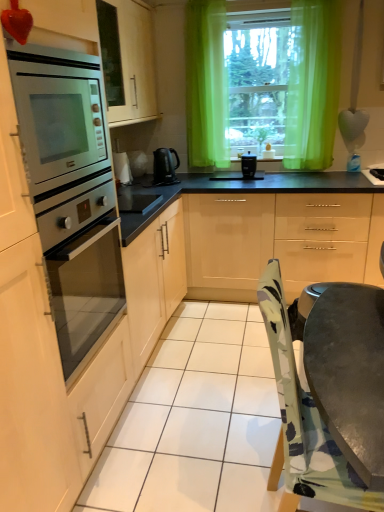
Question: From the image's perspective, is glossy beige cabinets at center beneath black plastic kettle at center?

Choices:
 (A) no
 (B) yes

Answer: (B)

Question: Is glossy beige cabinets at center smaller than black plastic kettle at center?

Choices:
 (A) yes
 (B) no

Answer: (B)

Question: From a real-world perspective, is glossy beige cabinets at center positioned over black plastic kettle at center based on gravity?

Choices:
 (A) yes
 (B) no

Answer: (B)

Question: Is glossy beige cabinets at center wider than black plastic kettle at center?

Choices:
 (A) yes
 (B) no

Answer: (A)

Question: Is glossy beige cabinets at center outside black plastic kettle at center?

Choices:
 (A) yes
 (B) no

Answer: (A)

Question: Does glossy beige cabinets at center turn towards black plastic kettle at center?

Choices:
 (A) yes
 (B) no

Answer: (B)

Question: Can you confirm if glossy beige cabinets at center is positioned to the right of black plastic coffee maker at center?

Choices:
 (A) yes
 (B) no

Answer: (A)

Question: Is glossy beige cabinets at center in front of black plastic coffee maker at center?

Choices:
 (A) yes
 (B) no

Answer: (A)

Question: Can you confirm if glossy beige cabinets at center is positioned to the left of black plastic coffee maker at center?

Choices:
 (A) no
 (B) yes

Answer: (A)

Question: From a real-world perspective, is glossy beige cabinets at center under black plastic coffee maker at center?

Choices:
 (A) no
 (B) yes

Answer: (B)

Question: Is glossy beige cabinets at center facing away from black plastic coffee maker at center?

Choices:
 (A) no
 (B) yes

Answer: (A)

Question: Could you tell me if glossy beige cabinets at center is facing black plastic coffee maker at center?

Choices:
 (A) yes
 (B) no

Answer: (B)

Question: Is green sheer curtains at upper center at the left side of black plastic coffee maker at center?

Choices:
 (A) yes
 (B) no

Answer: (B)